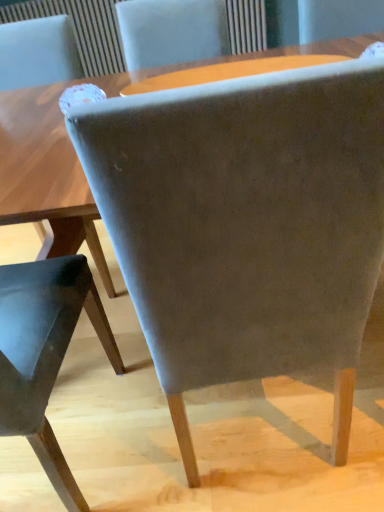
Question: Is matte wooden table at upper center to the left or to the right of suede gray chair at center, the second chair positioned from the right, in the image?

Choices:
 (A) left
 (B) right

Answer: (B)

Question: From the image's perspective, relative to suede gray chair at center, the first chair viewed from the left, is matte wooden table at upper center above or below?

Choices:
 (A) below
 (B) above

Answer: (B)

Question: Estimate the real-world distances between objects in this image. Which object is closer to the suede gray chair at center, the first chair viewed from the left?

Choices:
 (A) matte wooden table at upper center
 (B) suede-like gray chair at center, which is counted as the 1th chair, starting from the right

Answer: (B)

Question: Which is farther from the matte wooden table at upper center?

Choices:
 (A) suede gray chair at center, the second chair positioned from the right
 (B) suede-like gray chair at center, the 2th chair viewed from the left

Answer: (B)